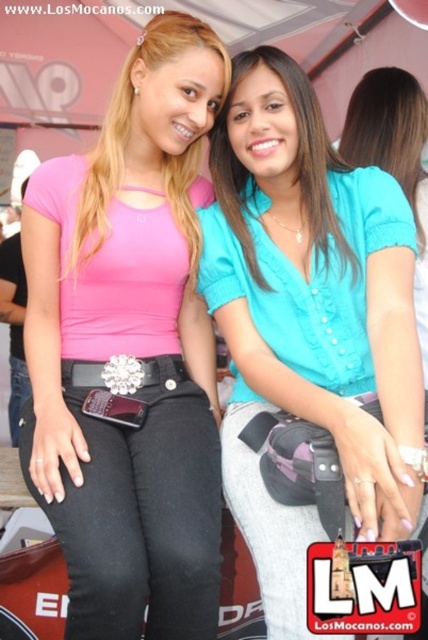
Is the position of matte pink shirt at center more distant than that of smooth teal blouse at center?

No, it is not.

Find the location of a particular element. This screenshot has width=428, height=640. matte pink shirt at center is located at coordinates (130, 348).

You are a GUI agent. You are given a task and a screenshot of the screen. Output one action in this format:
    pyautogui.click(x=<x>, y=<y>)
    Task: Click on the matte pink shirt at center
    
    Given the screenshot: What is the action you would take?
    pyautogui.click(x=130, y=348)

From the picture: Measure the distance between matte teal blouse at center and smooth teal blouse at center.

1.01 meters

Looking at this image, is matte teal blouse at center smaller than smooth teal blouse at center?

Correct, matte teal blouse at center occupies less space than smooth teal blouse at center.

What are the coordinates of `matte teal blouse at center` in the screenshot? It's located at 293,164.

Who is taller, matte teal blouse at center or silver metallic belt at center?

matte teal blouse at center is taller.

Which is more to the left, matte teal blouse at center or silver metallic belt at center?

silver metallic belt at center

Is point (321, 186) more distant than point (104, 369)?

That is True.

The image size is (428, 640). I want to click on matte teal blouse at center, so click(293, 164).